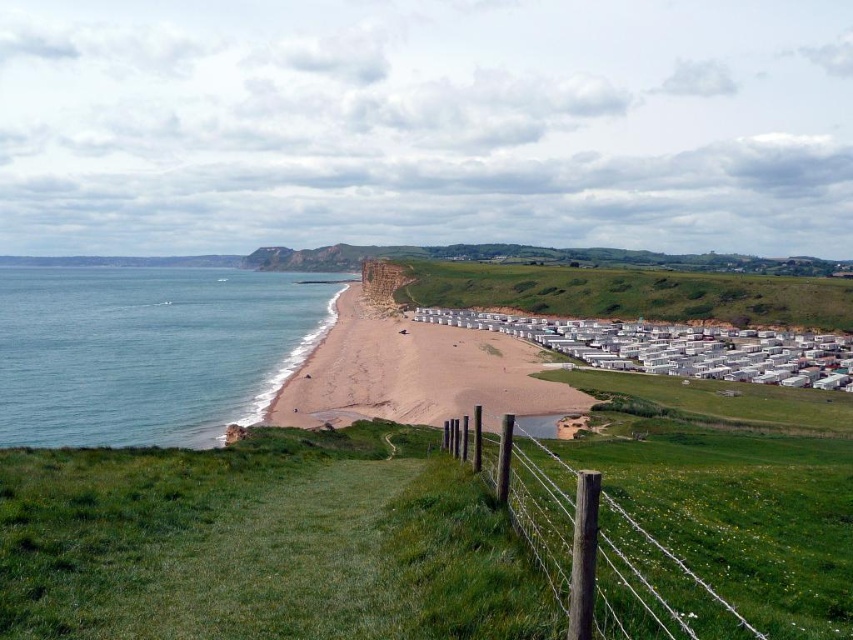
You are standing at the point with coordinates point at (148, 349). Which direction should you walk to reach the wooden fence running diagonally across the frame?

The point at (148, 349) corresponds to blue water at lower left. To reach the wooden fence running diagonally across the frame, you should walk towards the upper right direction since the fence is positioned in the foreground near the grassy hillside, while the blue water is located at the lower left.

You are standing on the light brown sand at center and want to walk to the brown wooden fence at lower right. Which direction should you move to get closer to the fence?

Since the light brown sand at center is further to the viewer than the brown wooden fence at lower right, you should move backward to get closer to the fence.